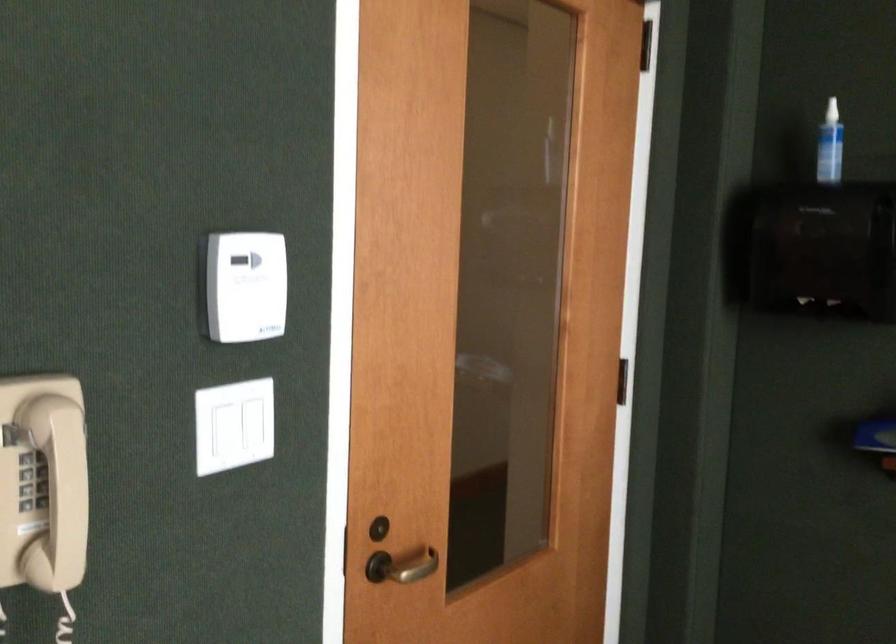
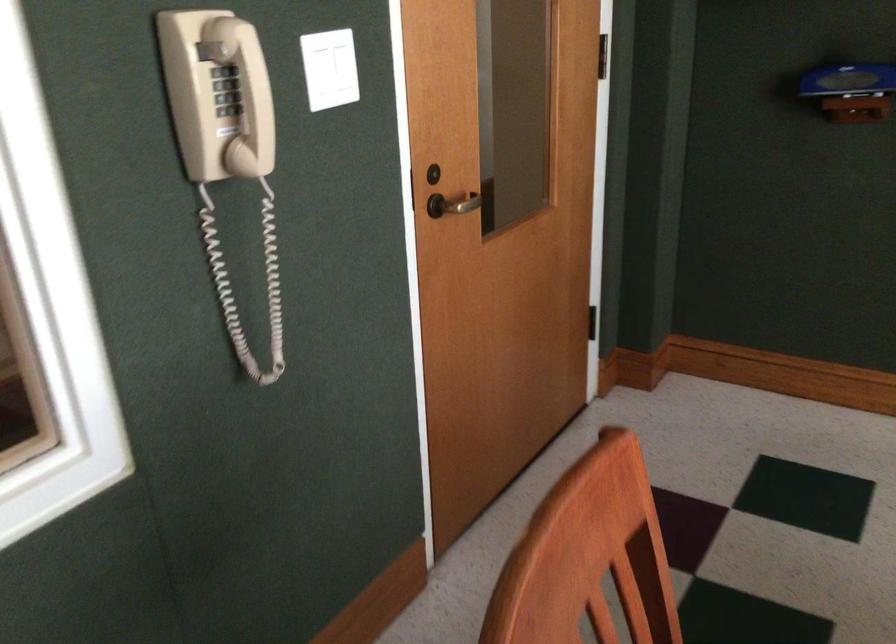
In a continuous first-person perspective shot, in which direction is the camera moving?

The movement direction of the cameraman is left, backward.